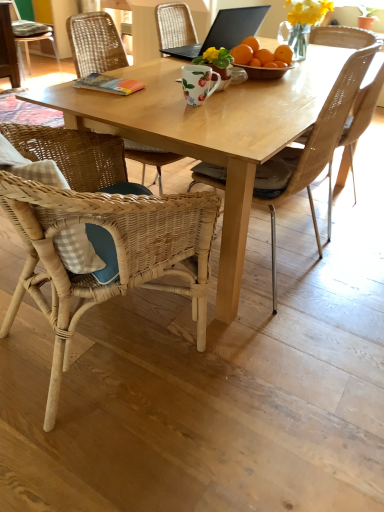
Locate an element on the screen. The height and width of the screenshot is (512, 384). free spot below woven wicker chair at lower left, arranged as the third chair when viewed from the right (from a real-world perspective) is located at coordinates [x=117, y=344].